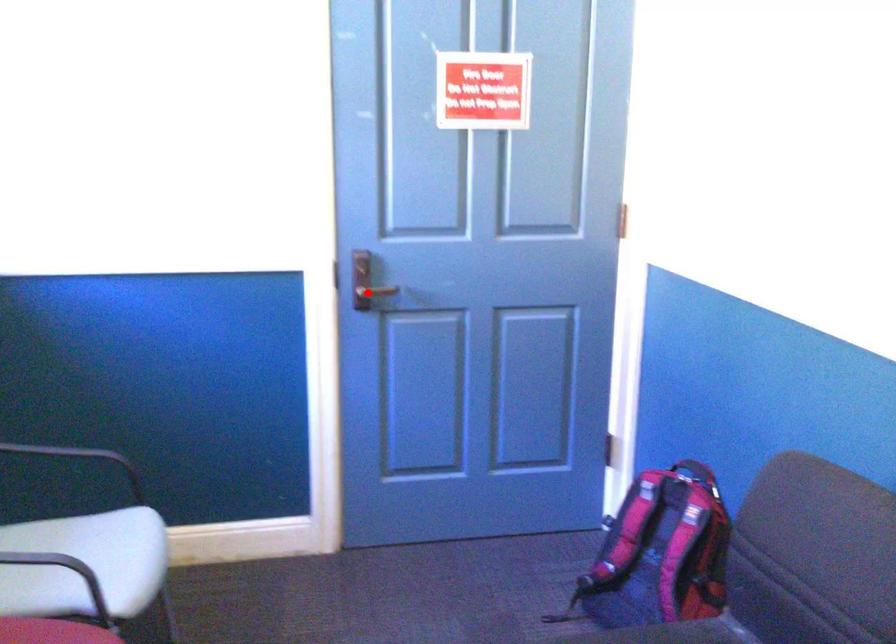
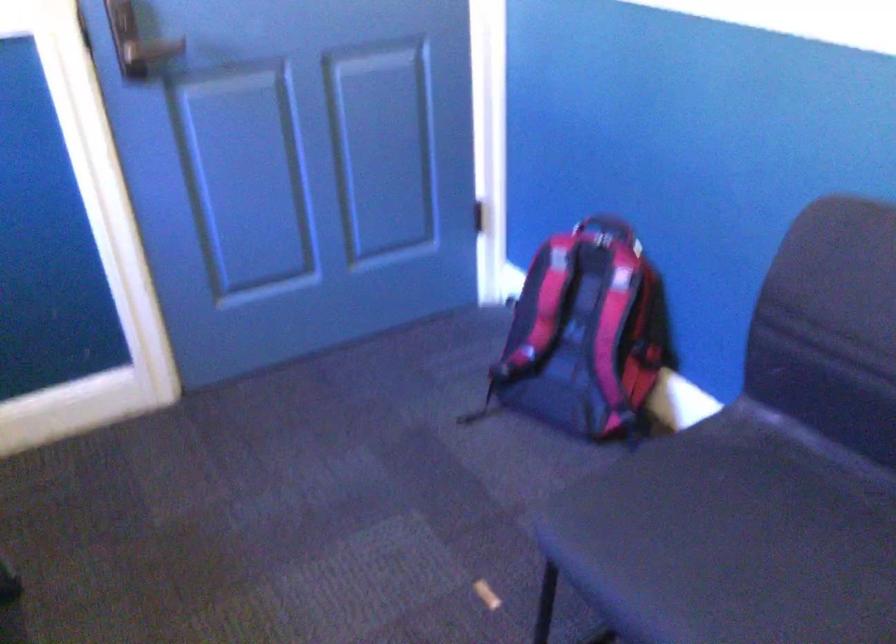
Locate, in the second image, the point that corresponds to the highlighted location in the first image.

(152, 50)